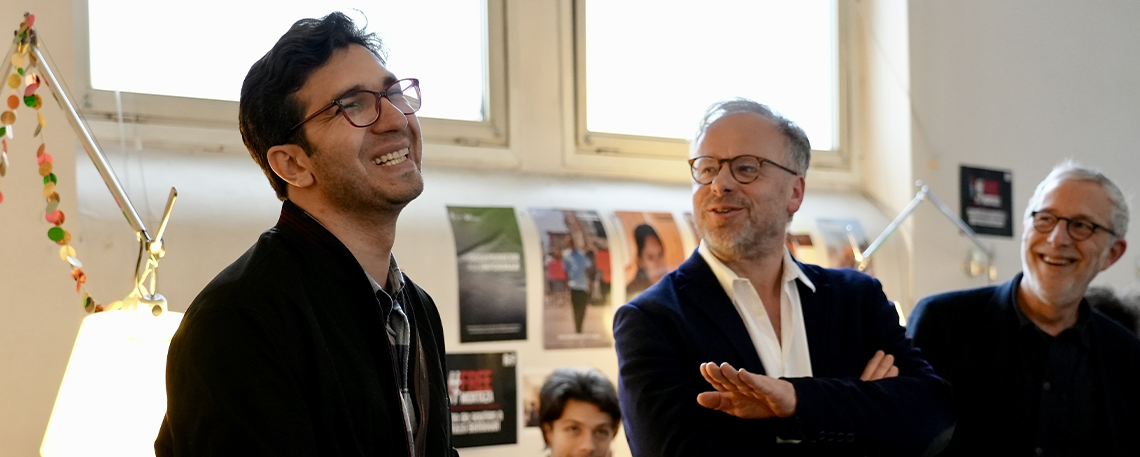
Where is `poster`? This screenshot has width=1140, height=457. poster is located at coordinates (602, 257), (350, 183).